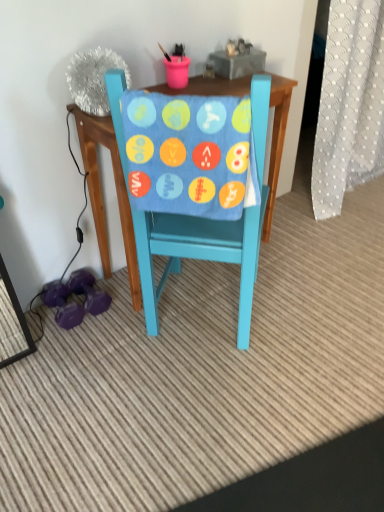
Question: Does white dotted fabric at right have a lesser width compared to teal painted wood chair at center?

Choices:
 (A) no
 (B) yes

Answer: (B)

Question: Does white dotted fabric at right touch teal painted wood chair at center?

Choices:
 (A) yes
 (B) no

Answer: (B)

Question: Does white dotted fabric at right appear on the right side of teal painted wood chair at center?

Choices:
 (A) no
 (B) yes

Answer: (B)

Question: From a real-world perspective, does white dotted fabric at right sit lower than teal painted wood chair at center?

Choices:
 (A) no
 (B) yes

Answer: (A)

Question: Does white dotted fabric at right appear on the left side of teal painted wood chair at center?

Choices:
 (A) yes
 (B) no

Answer: (B)

Question: Considering the positions of point (244, 172) and point (256, 84), is point (244, 172) closer or farther from the camera than point (256, 84)?

Choices:
 (A) closer
 (B) farther

Answer: (B)

Question: Considering the positions of blue soft fabric at center and teal painted wood chair at center in the image, is blue soft fabric at center wider or thinner than teal painted wood chair at center?

Choices:
 (A) thin
 (B) wide

Answer: (A)

Question: In terms of size, does blue soft fabric at center appear bigger or smaller than teal painted wood chair at center?

Choices:
 (A) small
 (B) big

Answer: (A)

Question: From their relative heights in the image, would you say blue soft fabric at center is taller or shorter than teal painted wood chair at center?

Choices:
 (A) tall
 (B) short

Answer: (B)

Question: Is teal painted wood chair at center inside the boundaries of blue soft fabric at center, or outside?

Choices:
 (A) outside
 (B) inside

Answer: (A)

Question: From the image's perspective, is teal painted wood chair at center above or below blue soft fabric at center?

Choices:
 (A) above
 (B) below

Answer: (B)

Question: Is point (145, 250) positioned closer to the camera than point (200, 159)?

Choices:
 (A) closer
 (B) farther

Answer: (B)

Question: Looking at the image, does teal painted wood chair at center seem bigger or smaller compared to blue soft fabric at center?

Choices:
 (A) big
 (B) small

Answer: (A)

Question: From their relative heights in the image, would you say white dotted fabric at right is taller or shorter than blue soft fabric at center?

Choices:
 (A) short
 (B) tall

Answer: (B)

Question: Does point (319, 208) appear closer or farther from the camera than point (152, 117)?

Choices:
 (A) farther
 (B) closer

Answer: (A)